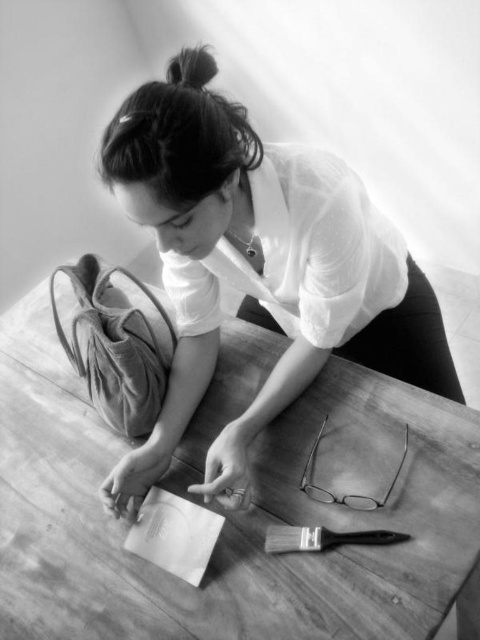
Which is below, smooth white blouse at upper center or black matte paintbrush at lower center?

black matte paintbrush at lower center

Does point (217, 467) lie in front of point (335, 534)?

That is False.

You are a GUI agent. You are given a task and a screenshot of the screen. Output one action in this format:
    pyautogui.click(x=<x>, y=<y>)
    Task: Click on the smooth white blouse at upper center
    This screenshot has height=640, width=480.
    Given the screenshot: What is the action you would take?
    pyautogui.click(x=259, y=266)

Describe the element at coordinates (116, 346) in the screenshot. I see `velvet-like fabric shoe at lower left` at that location.

Consider the image. Is velvet-like fabric shoe at lower left above black matte paintbrush at lower center?

Correct, velvet-like fabric shoe at lower left is located above black matte paintbrush at lower center.

Image resolution: width=480 pixels, height=640 pixels. Describe the element at coordinates (116, 346) in the screenshot. I see `velvet-like fabric shoe at lower left` at that location.

Locate an element on the screen. The height and width of the screenshot is (640, 480). velvet-like fabric shoe at lower left is located at coordinates (116, 346).

Who is taller, smooth white blouse at upper center or velvet-like fabric shoe at lower left?

smooth white blouse at upper center is taller.

Measure the distance between smooth white blouse at upper center and camera.

They are 30.42 inches apart.

This screenshot has height=640, width=480. What are the coordinates of `smooth white blouse at upper center` in the screenshot? It's located at (259, 266).